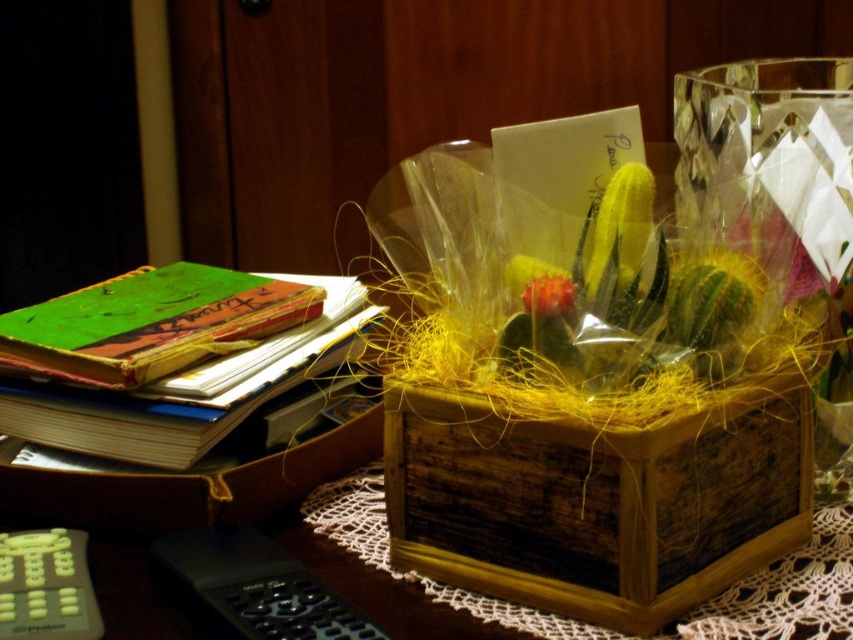
Does point (666, 488) lie in front of point (639, 262)?

That is True.

Between wooden box at center and green matte cactus at center, which one is positioned lower?

wooden box at center

What are the coordinates of `wooden box at center` in the screenshot? It's located at (596, 499).

Who is more forward, (74, 323) or (817, 177)?

Point (817, 177) is more forward.

Which is behind, point (57, 330) or point (839, 252)?

Positioned behind is point (57, 330).

Is point (115, 356) more distant than point (778, 131)?

That is True.

Identify the location of green matte book at left. Image resolution: width=853 pixels, height=640 pixels. (171, 358).

Based on the photo, which is more to the left, green matte book at left or green matte cactus at center?

green matte book at left

Can you confirm if green matte book at left is shorter than green matte cactus at center?

No.

Does point (67, 401) come behind point (621, 186)?

Yes, point (67, 401) is behind point (621, 186).

Locate an element on the screen. green matte book at left is located at coordinates (171, 358).